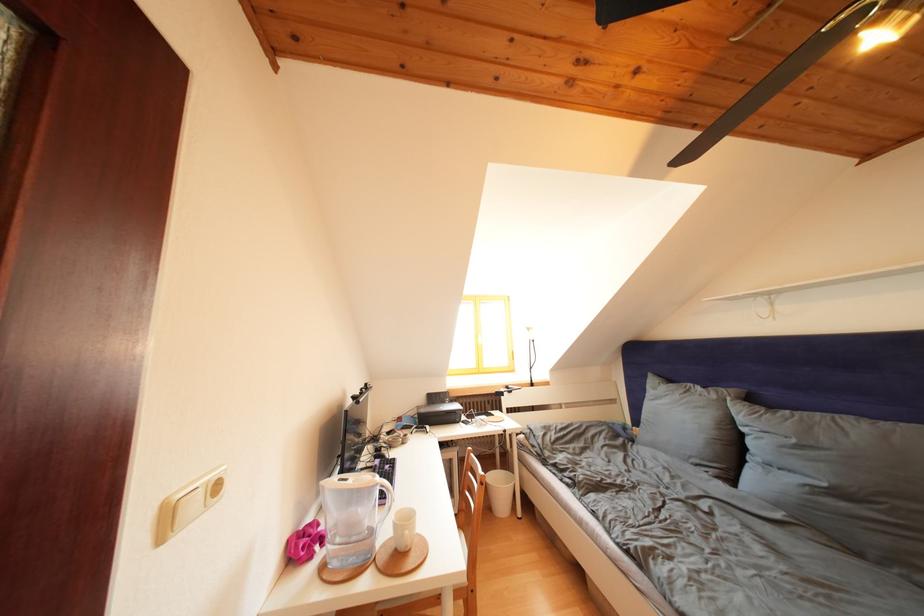
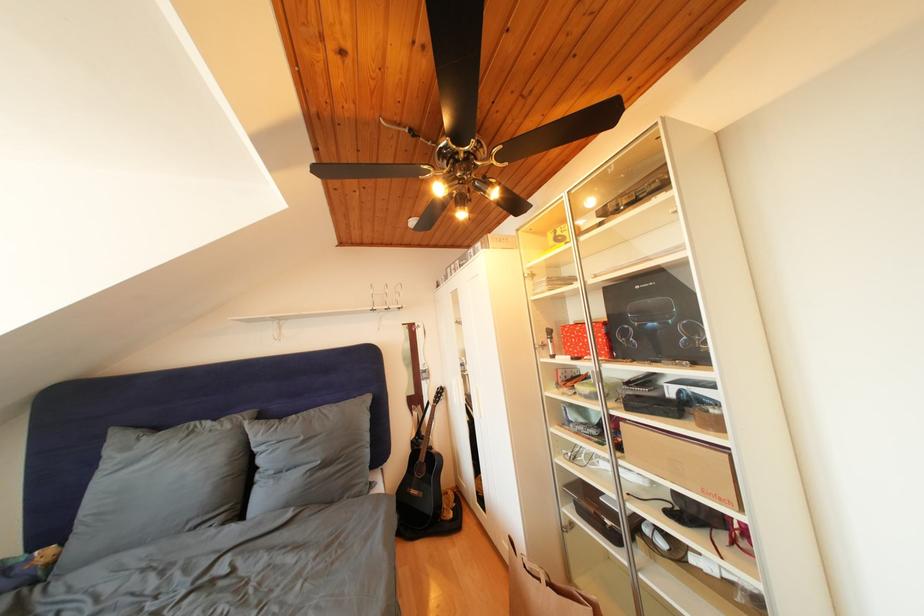
The point at [722,402] is marked in the first image. Where is the corresponding point in the second image?

(236, 432)